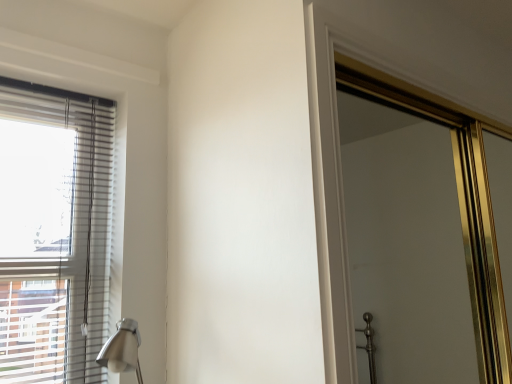
Where is `gold metallic screen door at right`? The height and width of the screenshot is (384, 512). gold metallic screen door at right is located at coordinates (459, 203).

This screenshot has height=384, width=512. What do you see at coordinates (459, 203) in the screenshot? I see `gold metallic screen door at right` at bounding box center [459, 203].

Image resolution: width=512 pixels, height=384 pixels. What are the coordinates of `gold metallic screen door at right` in the screenshot? It's located at (459, 203).